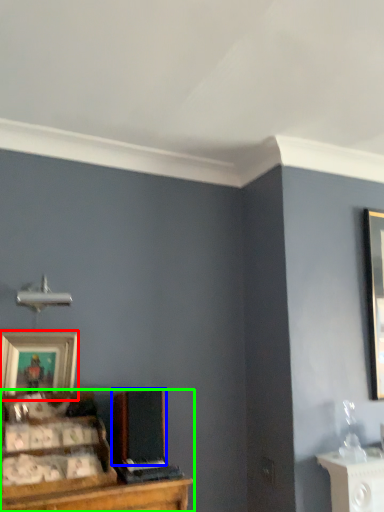
Question: Which is farther away from picture frame (highlighted by a red box)? speaker (highlighted by a blue box) or entertainment center (highlighted by a green box)?

Choices:
 (A) speaker
 (B) entertainment center

Answer: (A)